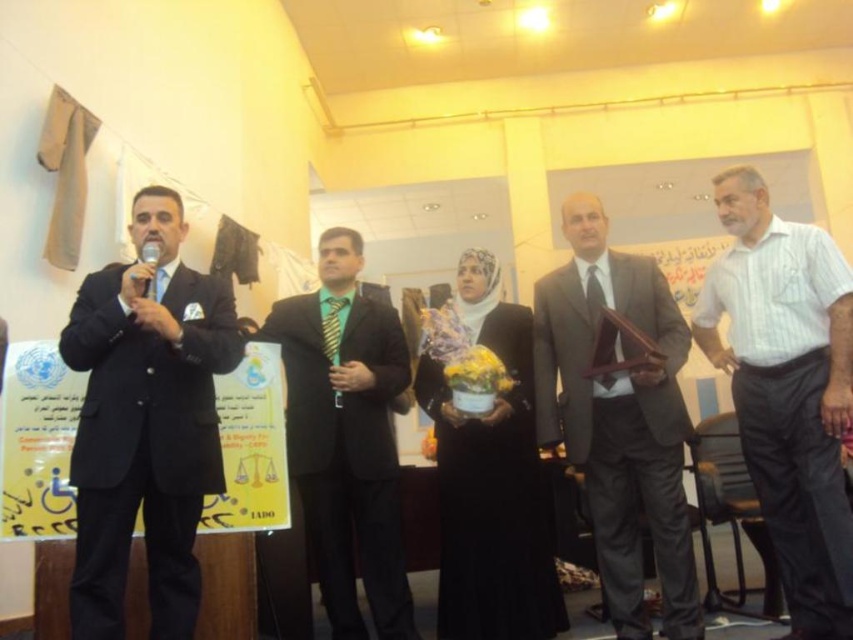
You are a photographer at the event and want to capture a clear shot of the green silk suit at center without the metallic silver microphone at left blocking it. What adjustment should you make to your camera angle?

The metallic silver microphone at left is behind the green silk suit at center, so you can adjust your camera angle to position it slightly forward of the green silk suit at center, ensuring the microphone is out of frame or obscured behind the suit.

You are a photographer at the event and want to capture a photo that includes both the point at position (817, 240) and the point at position (148, 250). Which point should you focus on first to ensure both are in focus?

You should focus on point (817, 240) first because it is closer to the camera than point (148, 250), ensuring both points are within the depth of field.

You are an event organizer who needs to arrange seating for the participants. Based on the image, which of the two individuals, the black suit at left or the white striped shirt at center, should be seated closer to the front due to their visibility in the current arrangement?

The black suit at left should be seated closer to the front because it is smaller than the white striped shirt at center, making it less visible from a distance.